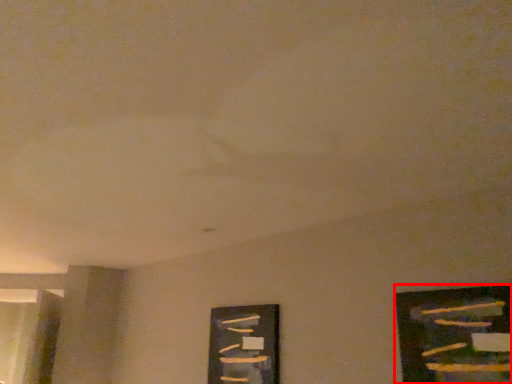
Question: From the image, what is the correct spatial relationship of picture frame (annotated by the red box) in relation to picture frame?

Choices:
 (A) left
 (B) right

Answer: (B)